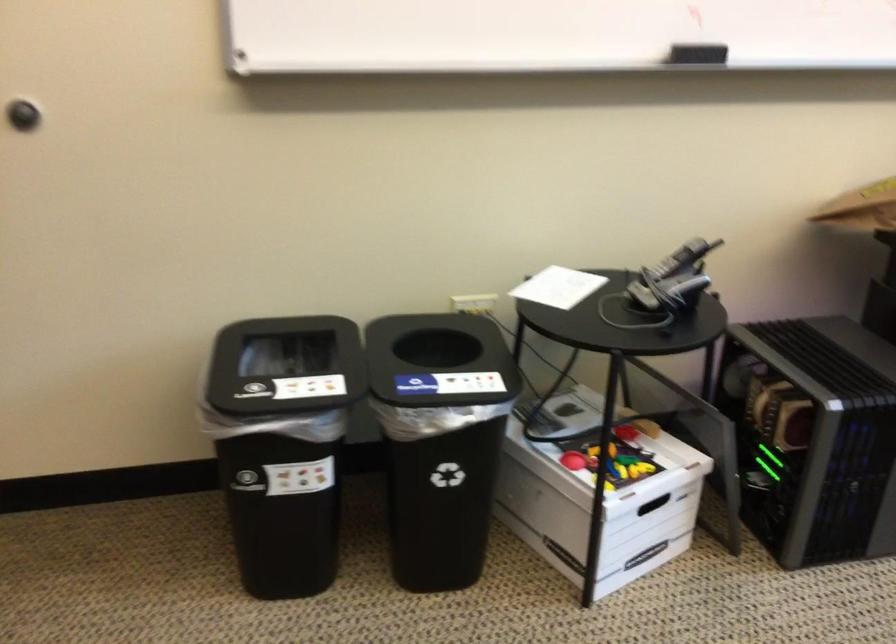
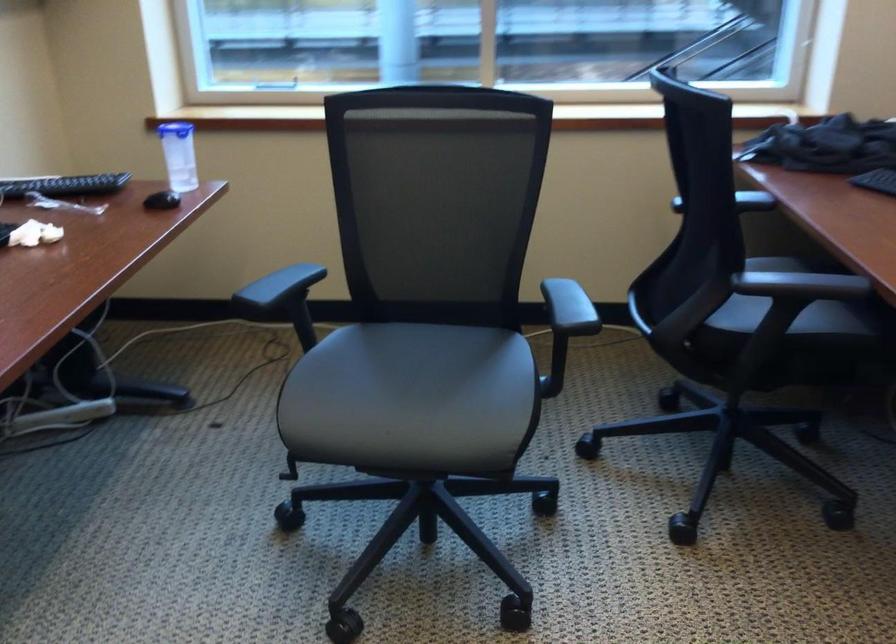
Question: The images are taken continuously from a first-person perspective. In which direction is your viewpoint rotating?

Choices:
 (A) Left
 (B) Right
 (C) Up
 (D) Down

Answer: (B)